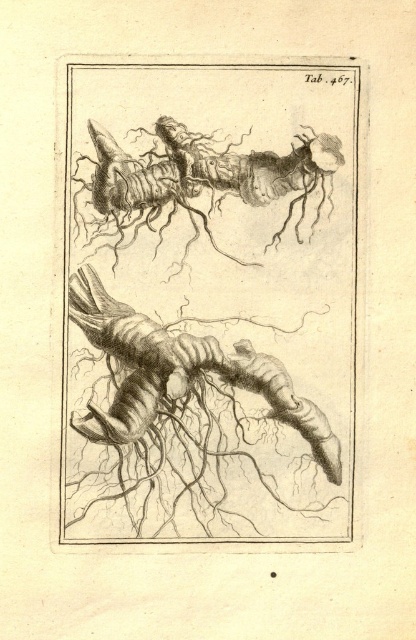
Can you confirm if etched wood roots at center is positioned above smooth black insect at center?

Actually, etched wood roots at center is below smooth black insect at center.

The image size is (416, 640). Describe the element at coordinates (208, 300) in the screenshot. I see `etched wood roots at center` at that location.

Locate an element on the screen. This screenshot has height=640, width=416. etched wood roots at center is located at coordinates (208, 300).